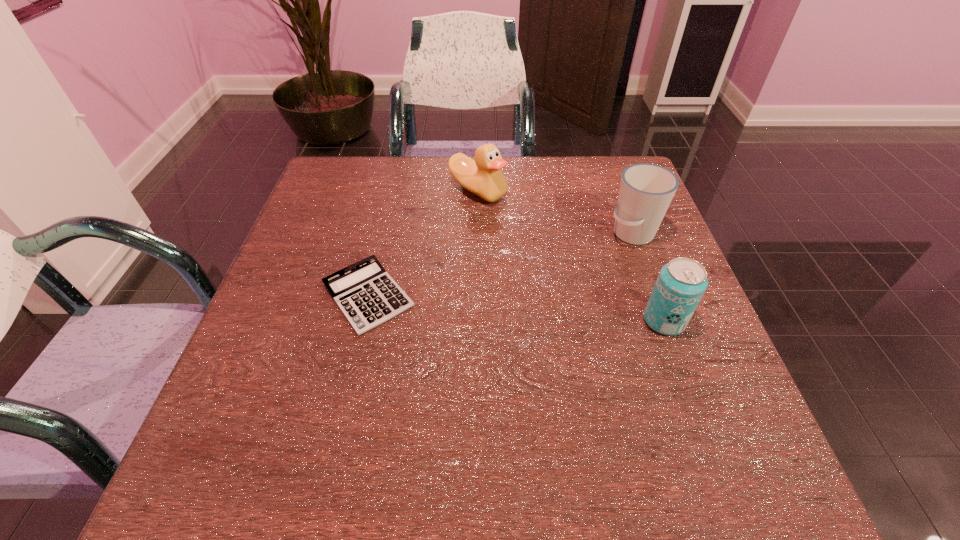
Locate an element on the screen. The height and width of the screenshot is (540, 960). vacant space at the left edge of the desktop is located at coordinates (272, 372).

The image size is (960, 540). Find the location of `vacant area at the right edge`. vacant area at the right edge is located at coordinates (640, 365).

Locate an element on the screen. Image resolution: width=960 pixels, height=540 pixels. vacant space at the far left corner of the desktop is located at coordinates (317, 191).

Locate an element on the screen. This screenshot has width=960, height=540. vacant space at the far right corner is located at coordinates 579,164.

Find the location of `unoccupied area between the third object from right to left and the beer can`. unoccupied area between the third object from right to left and the beer can is located at coordinates (571, 256).

Locate an element on the screen. This screenshot has height=540, width=960. vacant area between the beer can and the calculator is located at coordinates (516, 308).

You are a GUI agent. You are given a task and a screenshot of the screen. Output one action in this format:
    pyautogui.click(x=<x>, y=<y>)
    Task: Click on the vacant area that lies between the calculator and the beer can
    The width and height of the screenshot is (960, 540).
    Given the screenshot: What is the action you would take?
    pyautogui.click(x=516, y=308)

Locate an element on the screen. The image size is (960, 540). free spot between the calculator and the third object from right to left is located at coordinates (423, 244).

Identify the location of blank region between the shortest object and the farthest object. The image size is (960, 540). click(x=423, y=244).

Where is `free point between the beer can and the second object from left to right`? free point between the beer can and the second object from left to right is located at coordinates (571, 256).